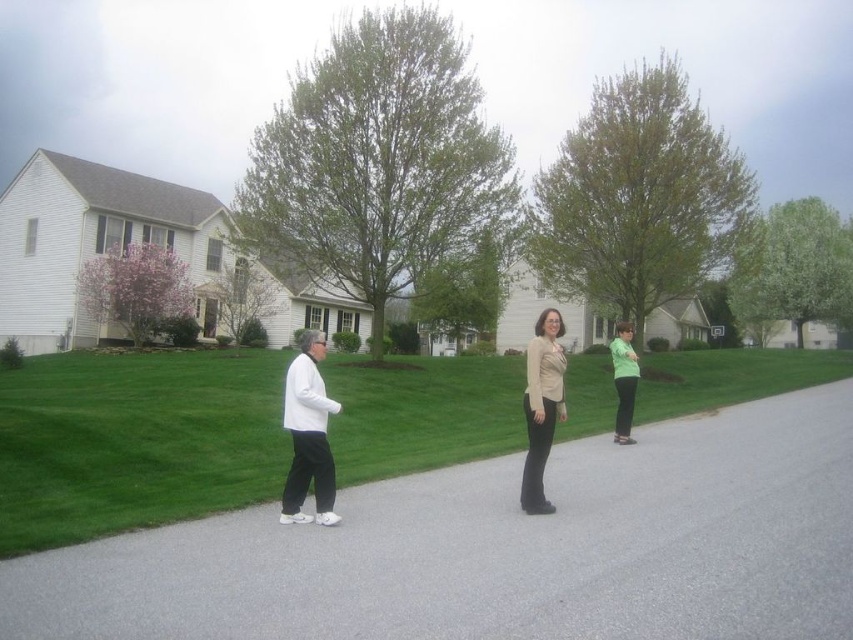
Question: Among these objects, which one is nearest to the camera?

Choices:
 (A) white matte jacket at center
 (B) green grass at center
 (C) beige fabric blouse at center
 (D) matte green sweater at right

Answer: (B)

Question: Does white matte jacket at center have a greater width compared to matte green sweater at right?

Choices:
 (A) no
 (B) yes

Answer: (B)

Question: Does white matte jacket at center have a smaller size compared to beige fabric blouse at center?

Choices:
 (A) yes
 (B) no

Answer: (B)

Question: Which point appears farthest from the camera in this image?

Choices:
 (A) click(x=541, y=468)
 (B) click(x=622, y=429)
 (C) click(x=299, y=397)

Answer: (B)

Question: Which point appears farthest from the camera in this image?

Choices:
 (A) (553, 323)
 (B) (32, 468)
 (C) (627, 428)
 (D) (311, 369)

Answer: (C)

Question: Can you confirm if green grass at center is positioned above beige fabric blouse at center?

Choices:
 (A) yes
 (B) no

Answer: (B)